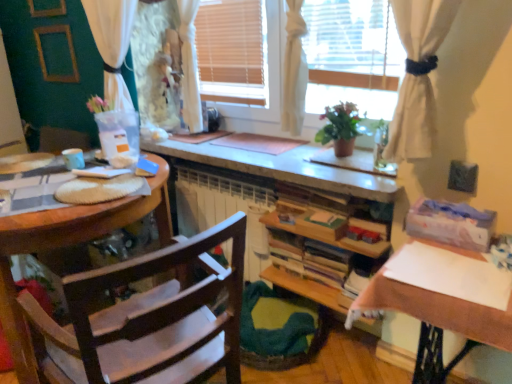
Question: Is white paper at right situated inside white sheer curtain at upper left or outside?

Choices:
 (A) outside
 (B) inside

Answer: (A)

Question: Visually, is white paper at right positioned to the left or to the right of white sheer curtain at upper left?

Choices:
 (A) right
 (B) left

Answer: (A)

Question: Which object is the closest to the white sheer curtain at upper left?

Choices:
 (A) wooden chair at left
 (B) green matte plant at center
 (C) white fabric window at center
 (D) white paper at right
 (E) wooden bookshelf at center

Answer: (C)

Question: Estimate the real-world distances between objects in this image. Which object is closer to the white paper at right?

Choices:
 (A) wooden bookshelf at center
 (B) wooden chair at left
 (C) green matte plant at center
 (D) white fabric window at center
 (E) white sheer curtain at upper left

Answer: (A)